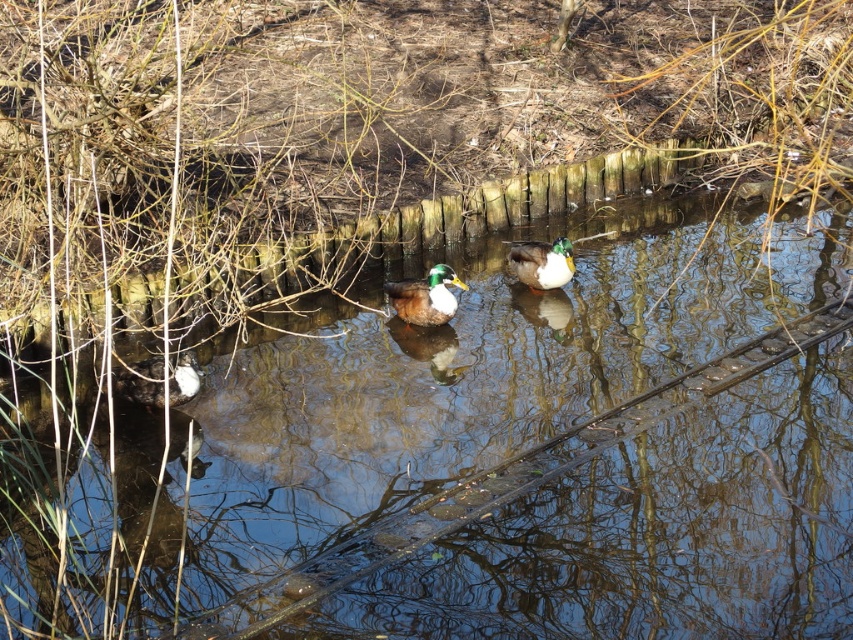
Based on the photo, is clear water at center further to the viewer compared to green glossy duck at center?

No, clear water at center is closer to the viewer.

Is clear water at center shorter than green glossy duck at center?

Indeed, clear water at center has a lesser height compared to green glossy duck at center.

The image size is (853, 640). What do you see at coordinates (482, 458) in the screenshot?
I see `clear water at center` at bounding box center [482, 458].

You are a GUI agent. You are given a task and a screenshot of the screen. Output one action in this format:
    pyautogui.click(x=<x>, y=<y>)
    Task: Click on the clear water at center
    This screenshot has width=853, height=640.
    Given the screenshot: What is the action you would take?
    pyautogui.click(x=482, y=458)

Is clear water at center positioned before shiny brown duck at center?

Yes, it is.

Based on the photo, who is more forward, (692, 403) or (392, 301)?

Point (692, 403)

What are the coordinates of `clear water at center` in the screenshot? It's located at (482, 458).

Can you confirm if white fluffy duck at lower left is taller than green glossy duck at center?

No.

Does white fluffy duck at lower left have a larger size compared to green glossy duck at center?

Correct, white fluffy duck at lower left is larger in size than green glossy duck at center.

The height and width of the screenshot is (640, 853). What are the coordinates of `white fluffy duck at lower left` in the screenshot? It's located at (143, 381).